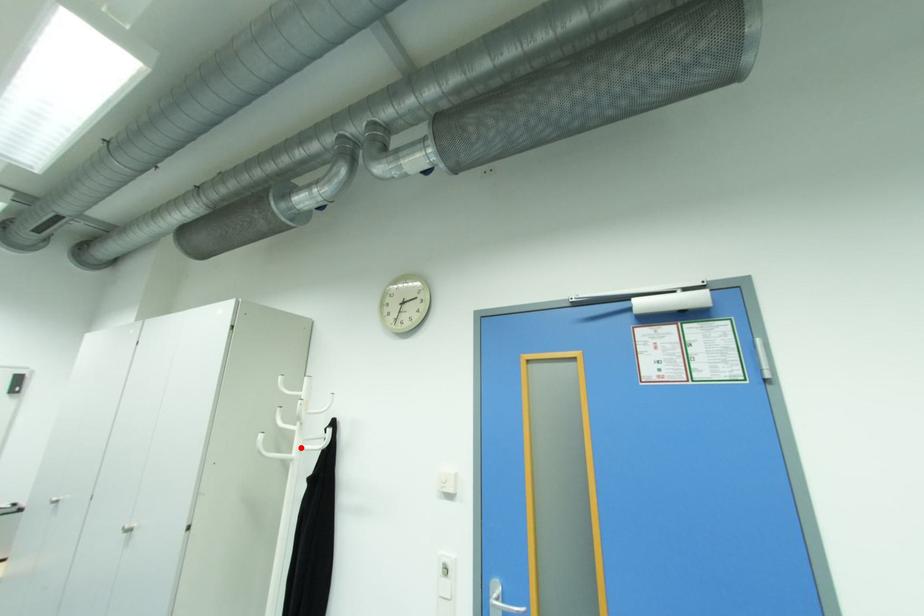
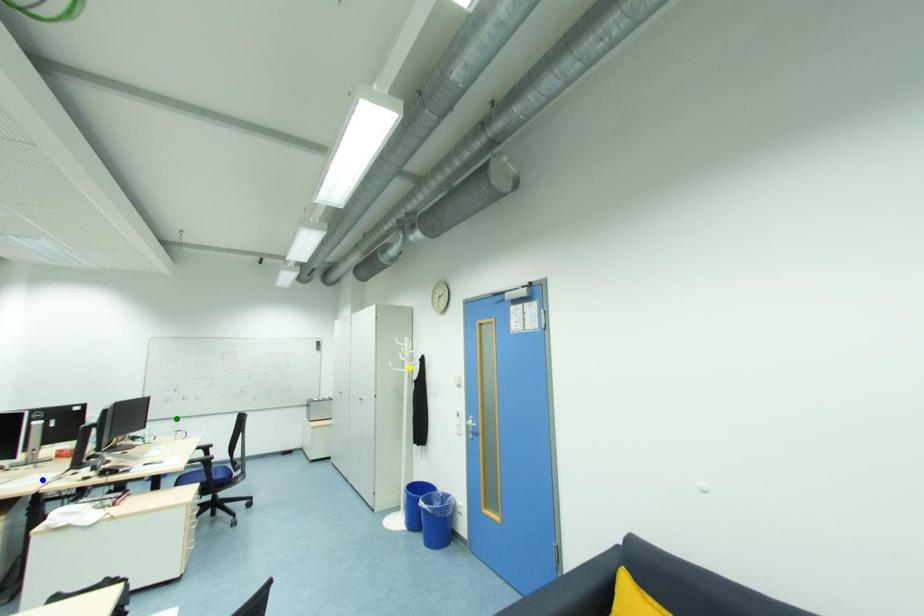
Question: I am providing you with two images of the same scene from different viewpoints. A red point is marked on the first image. You are given multiple points on the second image. Which point in image 2 is actually the same real-world point as the red point in image 1?

Choices:
 (A) yellow point
 (B) blue point
 (C) green point

Answer: (A)